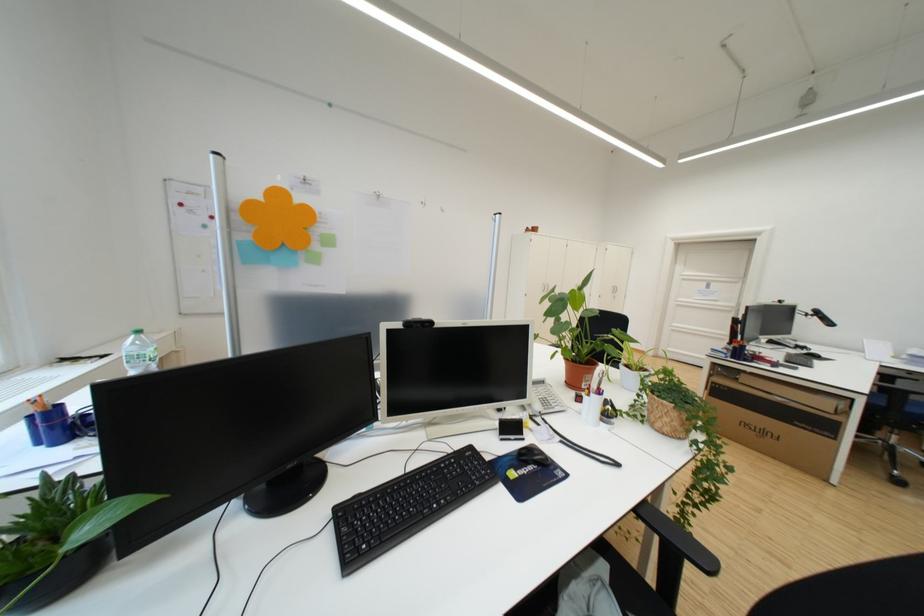
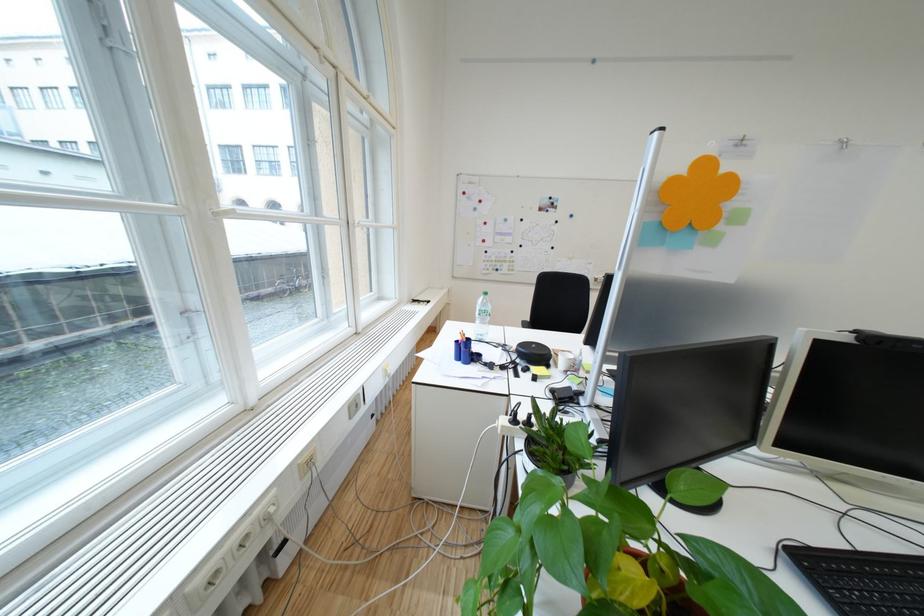
Question: How did the camera likely rotate?

Choices:
 (A) Left
 (B) Right
 (C) Up
 (D) Down

Answer: (A)